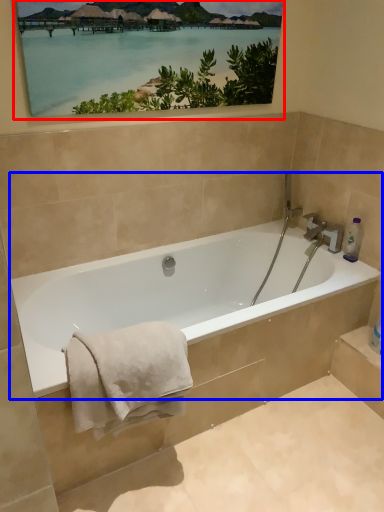
Question: Among these objects, which one is farthest to the camera, picture frame (highlighted by a red box) or bathtub (highlighted by a blue box)?

Choices:
 (A) picture frame
 (B) bathtub

Answer: (A)